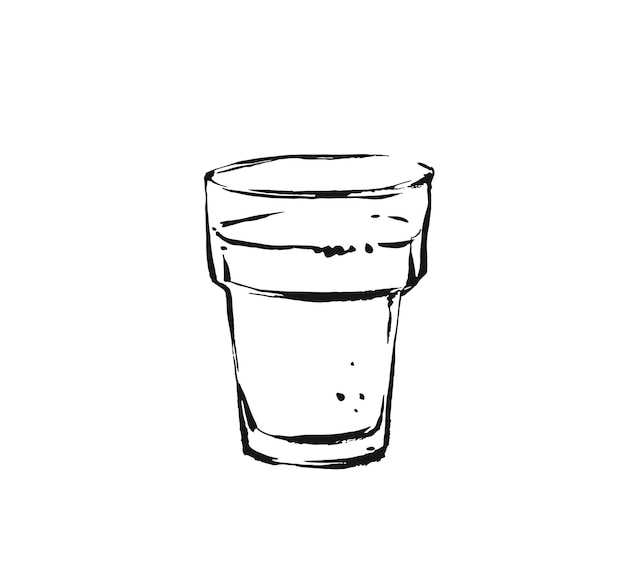
Image resolution: width=626 pixels, height=579 pixels. Identify the location of rim of the glass. (332, 156).